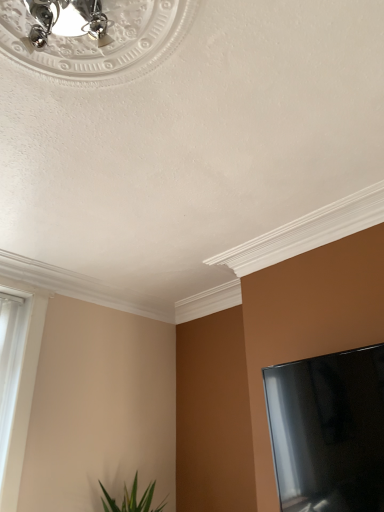
Image resolution: width=384 pixels, height=512 pixels. What do you see at coordinates (23, 394) in the screenshot?
I see `white fabric curtain at left` at bounding box center [23, 394].

At what (x,y) coordinates should I click in order to perform the action: click on white fabric curtain at left. Please return your answer as a coordinate pair (x, y). Looking at the image, I should click on (23, 394).

Measure the distance between point (24,434) and camera.

Point (24,434) and camera are 2.47 meters apart.

Locate an element on the screen. white fabric curtain at left is located at coordinates (23, 394).